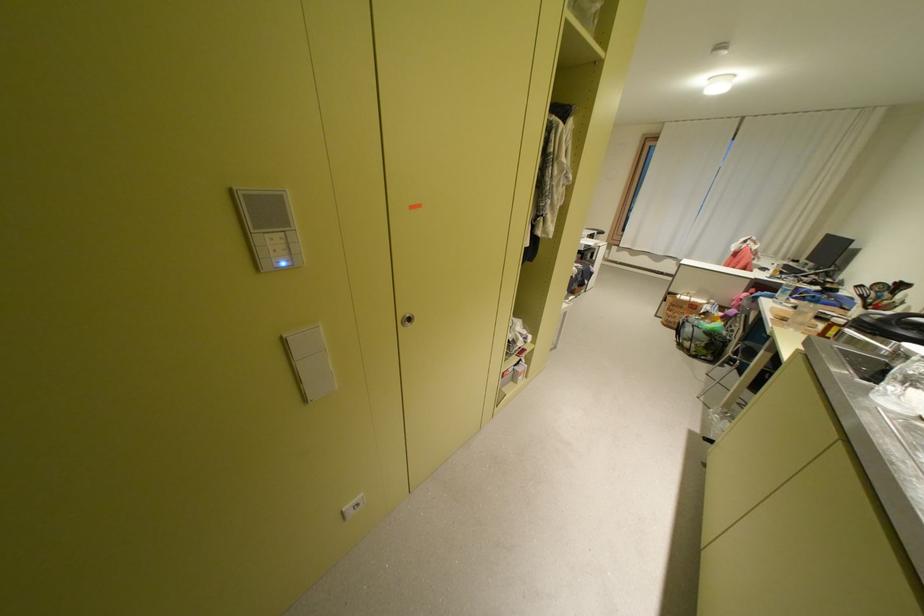
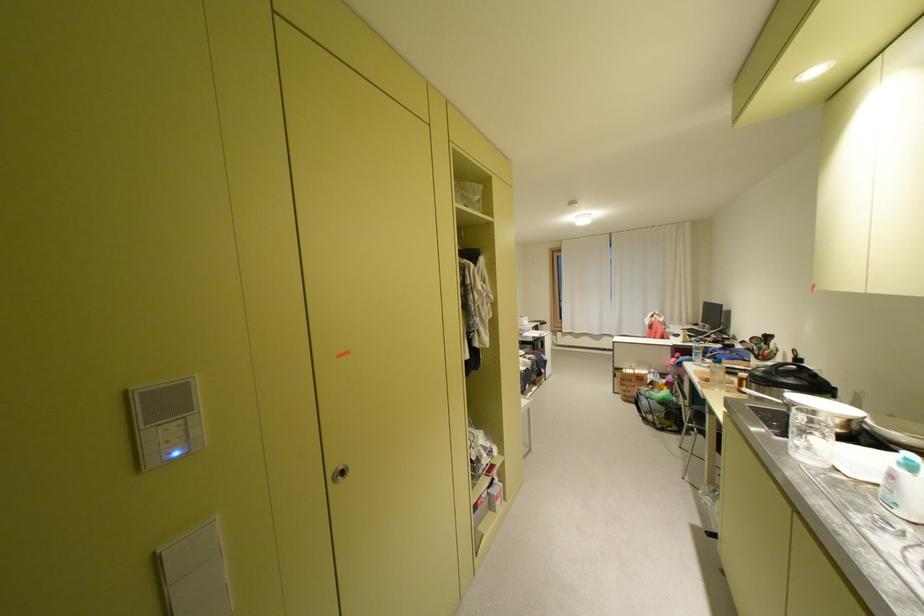
Question: Based on the continuous images, in which direction is the camera rotating? Reply with the corresponding letter.

Choices:
 (A) Left
 (B) Right
 (C) Up
 (D) Down

Answer: (C)